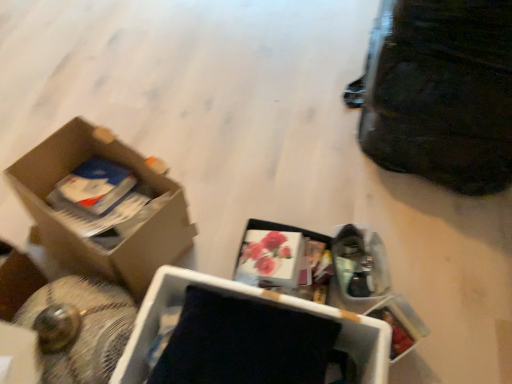
What are the coordinates of `vacant region to the left of black leather bag at upper right` in the screenshot? It's located at (273, 102).